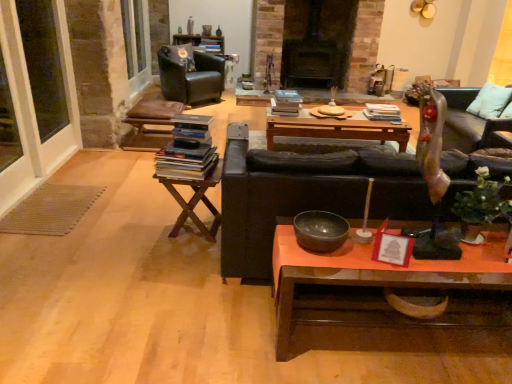
The width and height of the screenshot is (512, 384). Identify the location of vacant area that is in front of woodenwoodentable at left. (174, 259).